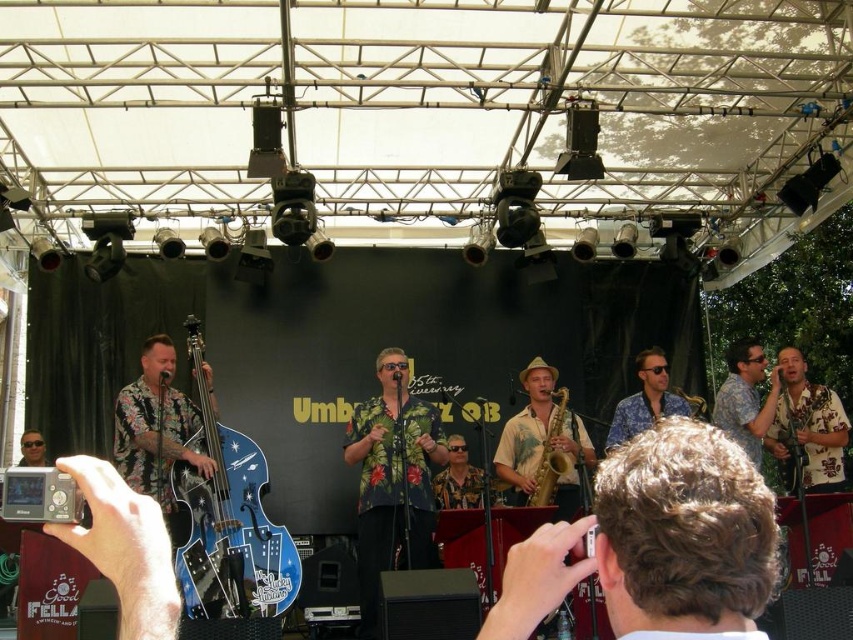
Question: Which of the following is the farthest from the observer?

Choices:
 (A) (608, 433)
 (B) (556, 390)
 (C) (762, 365)
 (D) (578, 417)

Answer: (C)

Question: Is blue glossy electric guitar at left further to the viewer compared to floral fabric saxophone at center?

Choices:
 (A) yes
 (B) no

Answer: (B)

Question: Does floral fabric saxophone at center lie in front of floral print shirt at center?

Choices:
 (A) yes
 (B) no

Answer: (A)

Question: Which point is closer to the camera?

Choices:
 (A) floral print shirt at center
 (B) floral fabric saxophone at center
 (C) floral shirt at center
 (D) gold metallic saxophone at center

Answer: (B)

Question: Estimate the real-world distances between objects in this image. Which object is closer to the gold metallic saxophone at center?

Choices:
 (A) floral fabric saxophone at center
 (B) floral print shirt at center

Answer: (A)

Question: Is floral fabric saxophone at center above floral print shirt at center?

Choices:
 (A) no
 (B) yes

Answer: (A)